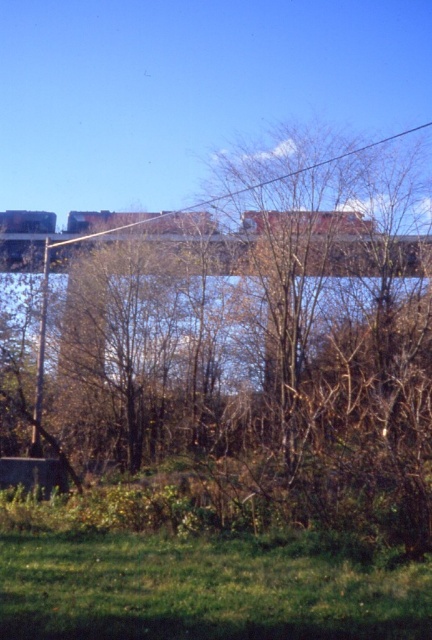
You are a gardener assessing the terrain. You see the green grass at lower center and the metallic gray train bridge at center. Which object is shorter in height?

The green grass at lower center is shorter than the metallic gray train bridge at center.

You are standing at the point marked as point (199, 584) in the image. What is the closest object to you in the scene?

The closest object to you at point (199, 584) is the green grass at lower center, as it is located exactly at that coordinate.

In the scene shown: You are standing at the origin point of the coordinate system. Which direction should you move to reach the metallic gray train bridge at center?

The metallic gray train bridge at center is located at coordinate point 0.398 on the x axis and 0.840 on the y axis. Since the origin is at the bottom left corner, moving towards the right and upwards will reach the bridge.